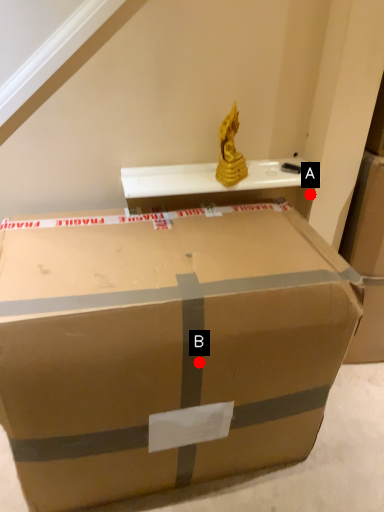
Question: Two points are circled on the image, labeled by A and B beside each circle. Which of the following is the farthest from the observer?

Choices:
 (A) A is further
 (B) B is further

Answer: (A)